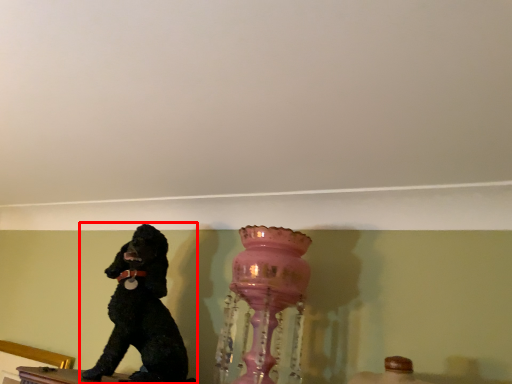
Question: From the image's perspective, considering the relative positions of dog (annotated by the red box) and vase in the image provided, where is dog (annotated by the red box) located with respect to the staircase?

Choices:
 (A) above
 (B) below

Answer: (B)